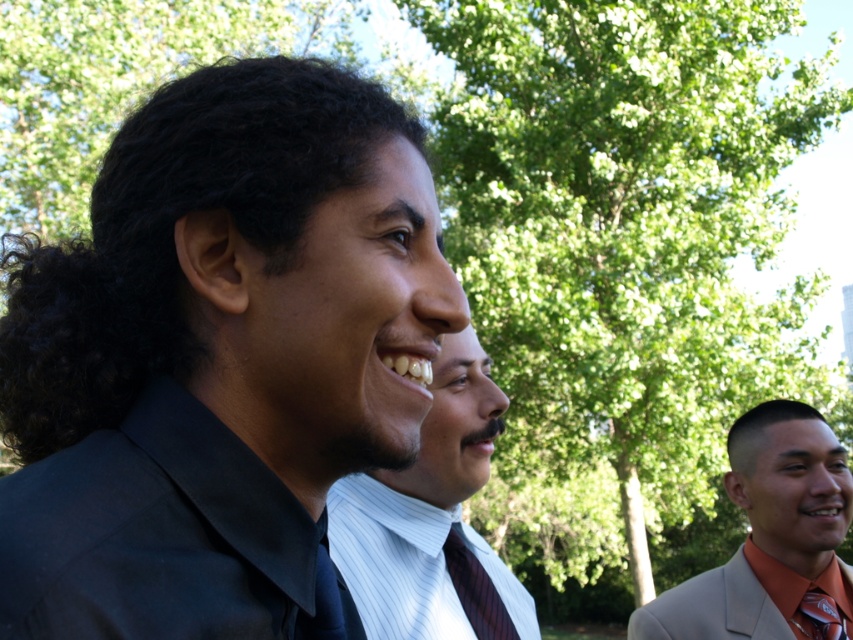
You are a photographer trying to capture a candid shot of both the matte black shirt at center and the smooth white shirt at center. Since you want to ensure both are in focus, which shirt should you focus on first to maximize the chances of both being sharp?

You should focus on the matte black shirt at center first because it is closer to the viewer than the smooth white shirt at center. By focusing on the closer object, the depth of field will extend backward, potentially keeping both shirts in focus.

You are a photographer trying to capture a candid shot of the matte black tie at center and the green leafy tree at center. Which object will appear wider in the photo?

The green leafy tree at center will appear wider in the photo since its width surpasses that of the matte black tie at center according to the description.